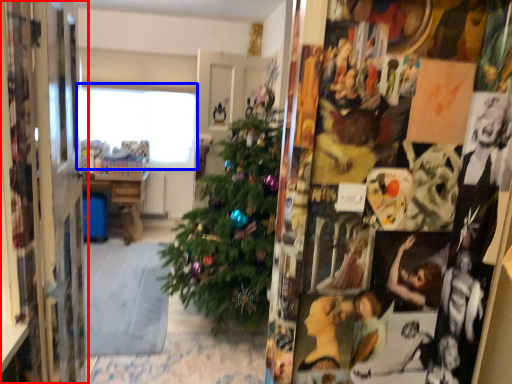
Question: Which of the following is the closest to the observer, collage (highlighted by a red box) or window (highlighted by a blue box)?

Choices:
 (A) collage
 (B) window

Answer: (A)